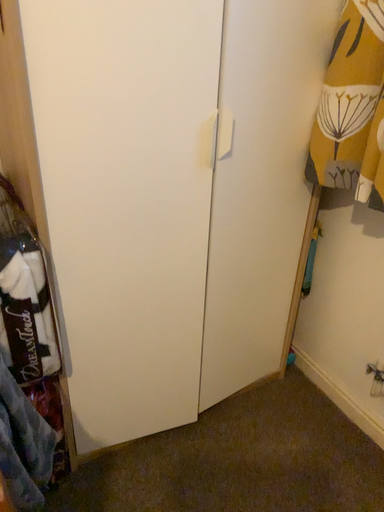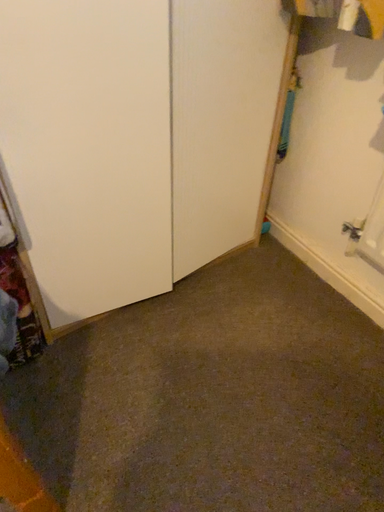
Question: How did the camera likely rotate when shooting the video?

Choices:
 (A) rotated upward
 (B) rotated downward

Answer: (B)